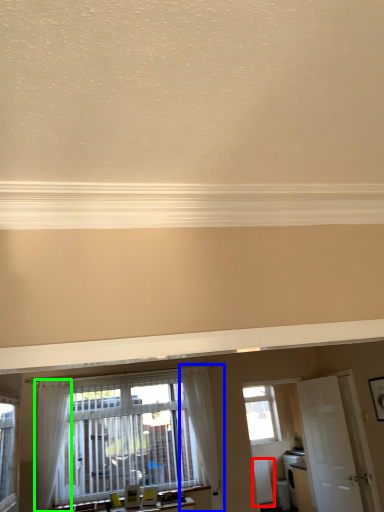
Question: Which object is the farthest from radiator (highlighted by a red box)? Choose among these: curtain (highlighted by a blue box) or curtain (highlighted by a green box).

Choices:
 (A) curtain
 (B) curtain

Answer: (B)